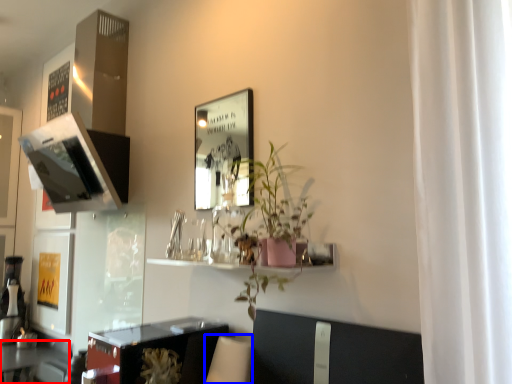
Question: Which point is closer to the camera, table (highlighted by a red box) or swivel chair (highlighted by a blue box)?

Choices:
 (A) table
 (B) swivel chair

Answer: (B)